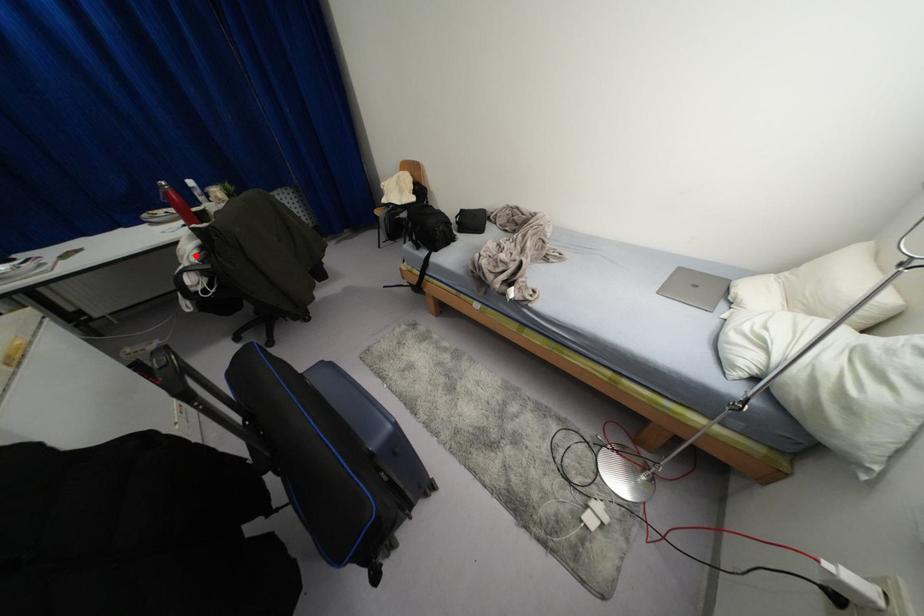
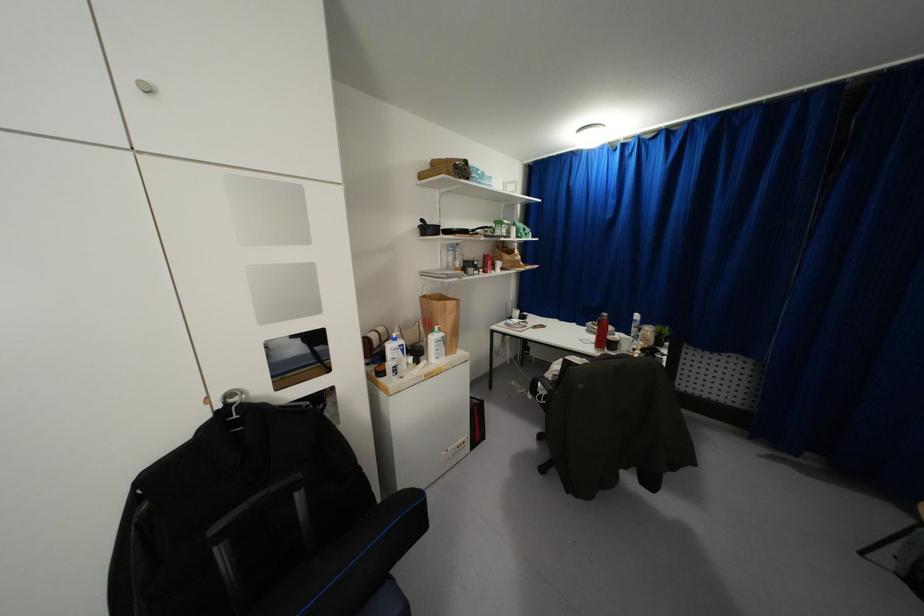
Where in the second image is the point corresponding to the highlighted location from the first image?

(553, 376)